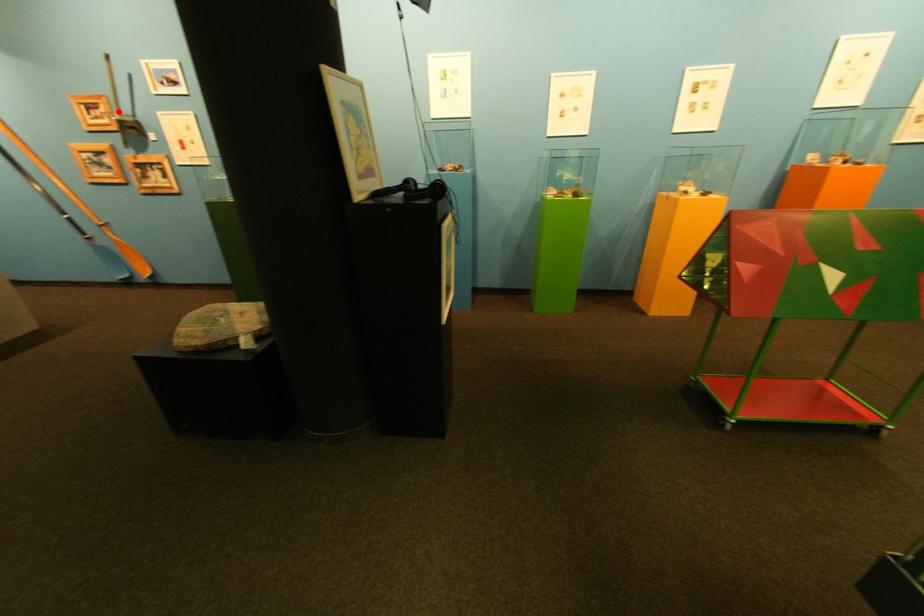
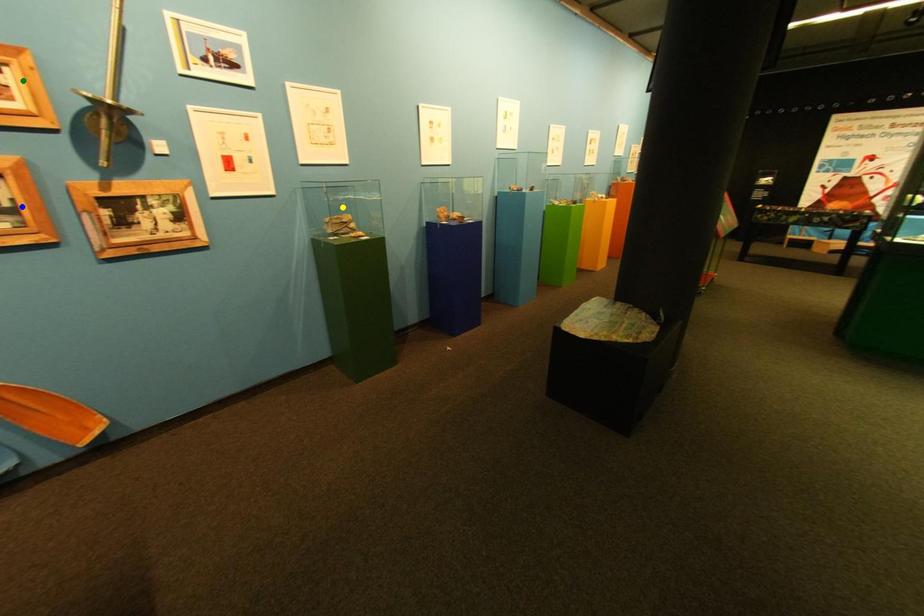
Question: I am providing you with two images of the same scene from different viewpoints. A red point is marked on the first image. You are given multiple points on the second image. Which spot in image 2 lines up with the point in image 1?

Choices:
 (A) blue point
 (B) yellow point
 (C) green point

Answer: (C)